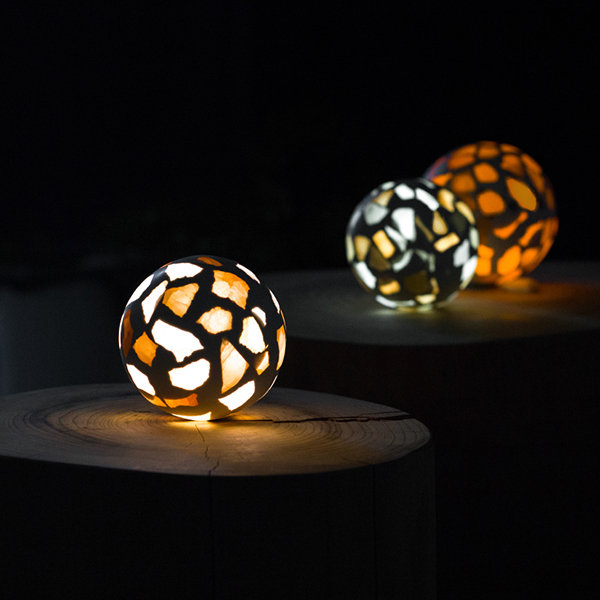
Locate an element on the screen. wood stand is located at coordinates [x=317, y=447].